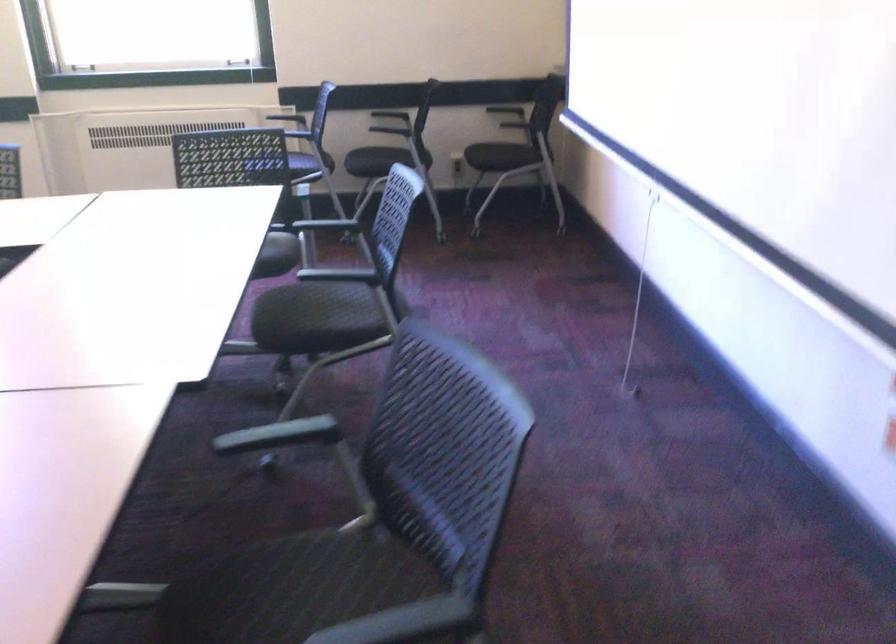
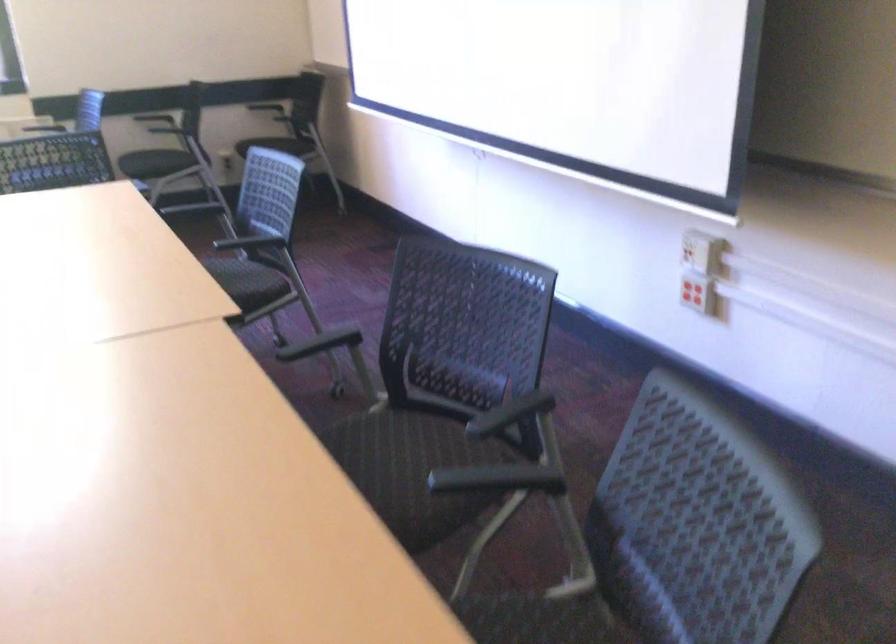
In the second image, find the point that corresponds to pixel 349 317 in the first image.

(245, 281)